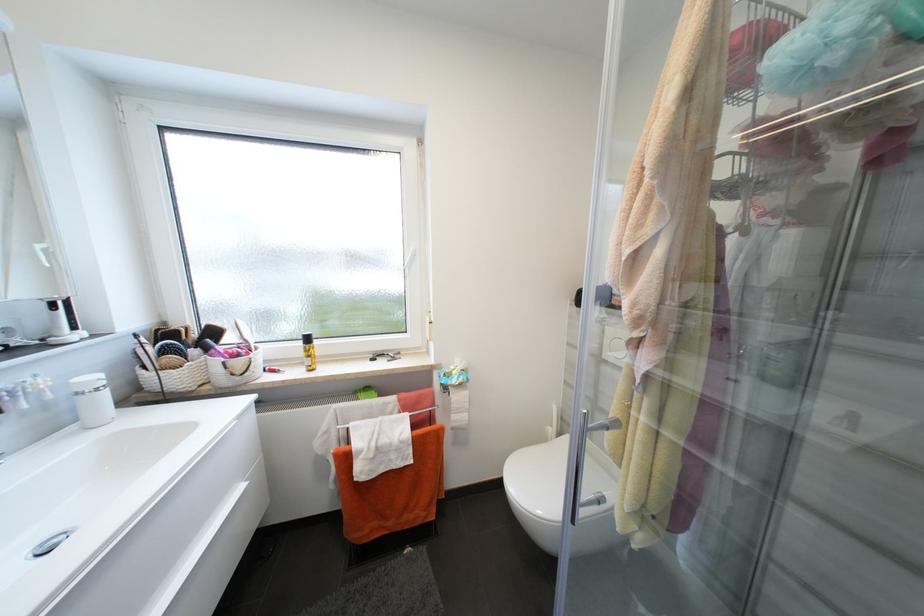
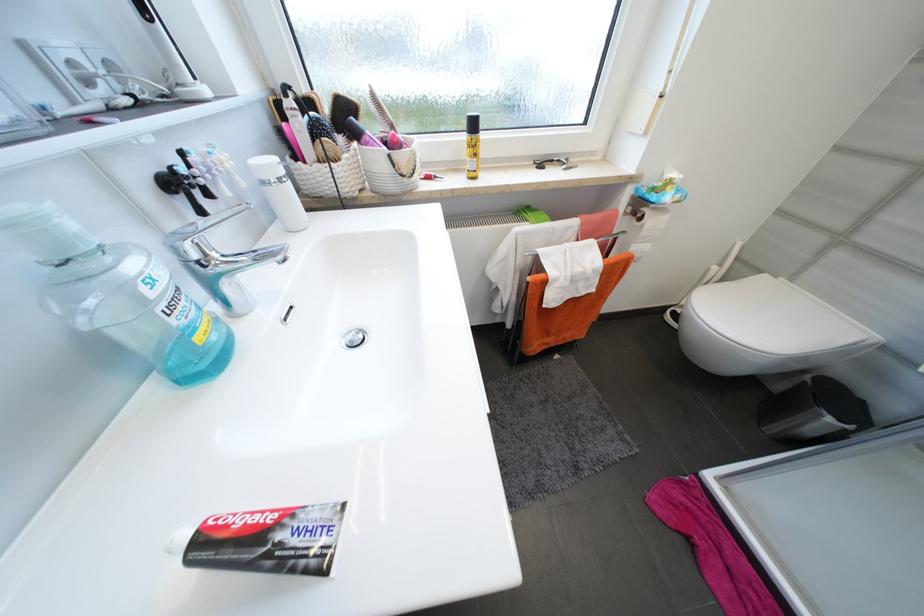
Locate, in the second image, the point that corresponds to pixel 169 323 in the first image.

(280, 92)